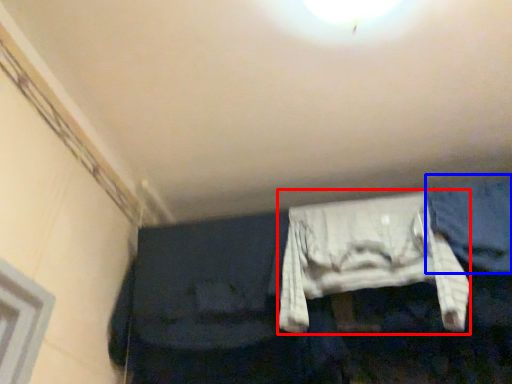
Question: Which point is closer to the camera, clothing (highlighted by a red box) or jeans (highlighted by a blue box)?

Choices:
 (A) clothing
 (B) jeans

Answer: (A)